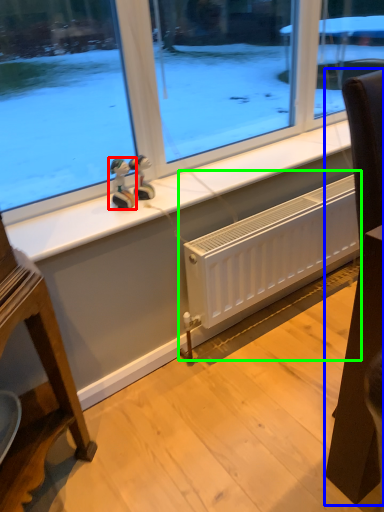
Question: Which object is the farthest from figurine (highlighted by a red box)? Choose among these: furniture (highlighted by a blue box) or radiator (highlighted by a green box).

Choices:
 (A) furniture
 (B) radiator

Answer: (A)